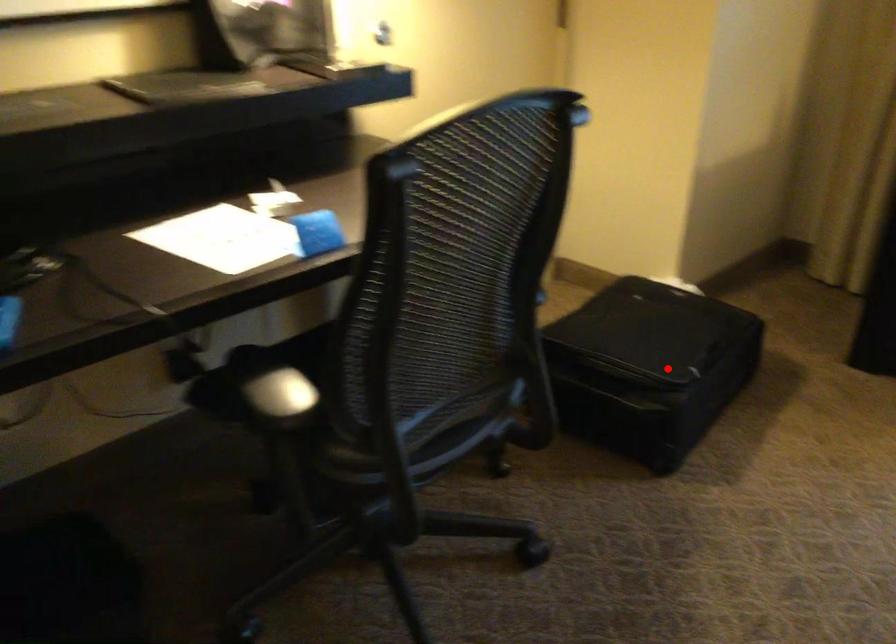
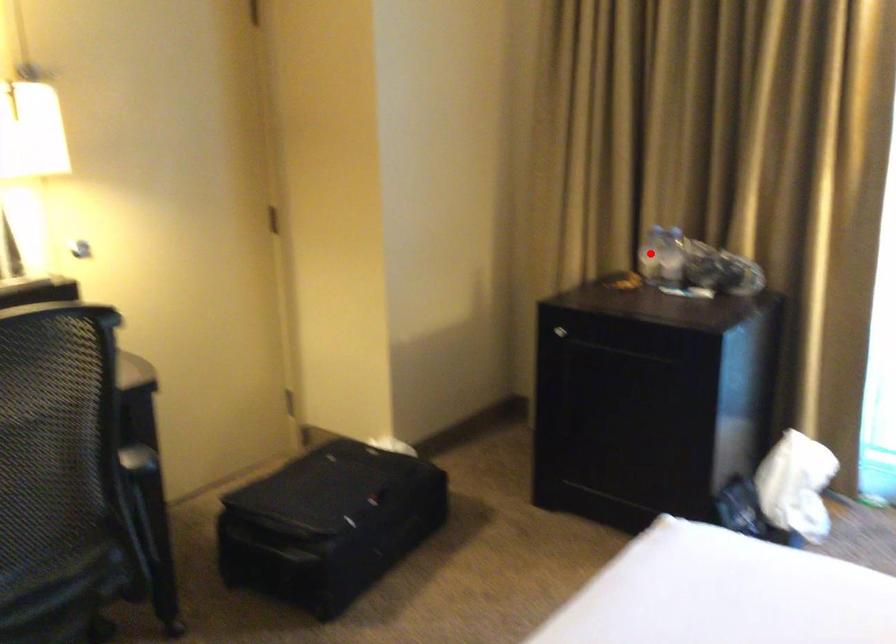
I am providing you with two images of the same scene from different viewpoints. A red point is marked on the first image and another point is marked on the second image. Are the points marked in image1 and image2 representing the same 3D position?

No